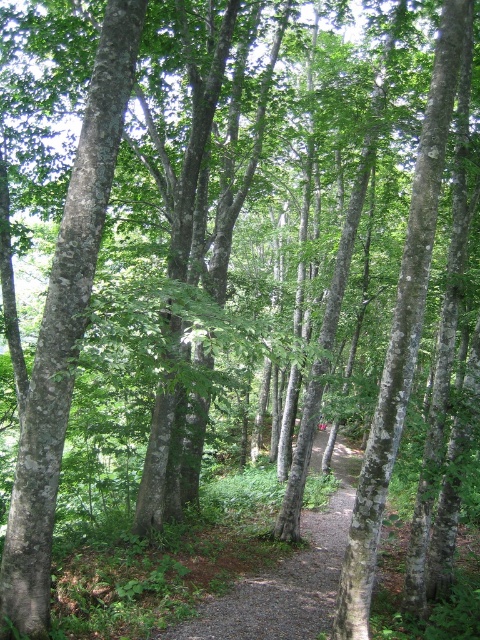
Question: Which of the following is the farthest from the observer?

Choices:
 (A) dirt/gravel path at center
 (B) smooth bark tree at center

Answer: (A)

Question: Does smooth bark tree at center lie in front of dirt/gravel path at center?

Choices:
 (A) no
 (B) yes

Answer: (B)

Question: Among these objects, which one is farthest from the camera?

Choices:
 (A) dirt/gravel path at center
 (B) smooth bark tree at center

Answer: (A)

Question: Does smooth bark tree at center have a larger size compared to dirt/gravel path at center?

Choices:
 (A) yes
 (B) no

Answer: (B)

Question: Does smooth bark tree at center have a larger size compared to dirt/gravel path at center?

Choices:
 (A) no
 (B) yes

Answer: (A)